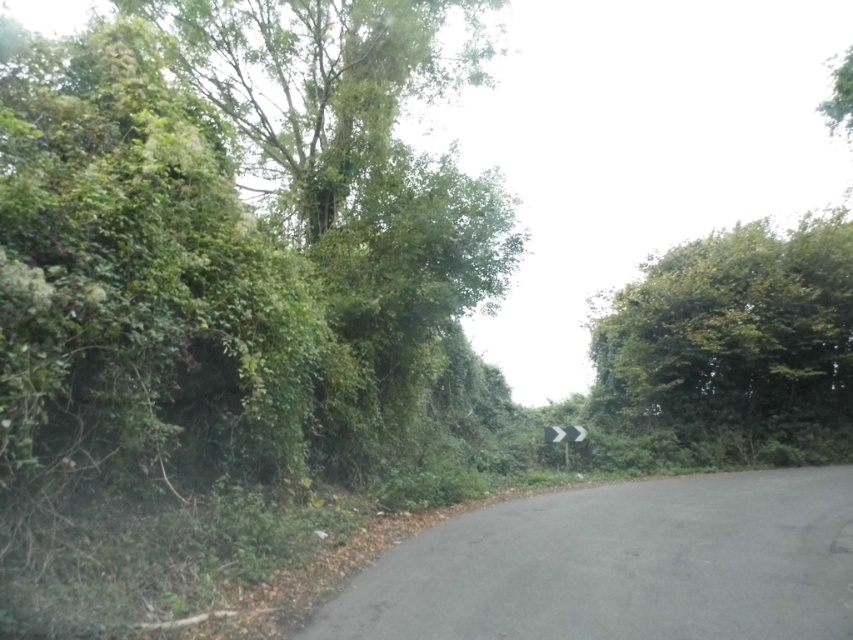
From the picture: You are standing at the center of the road and looking towards the direction of the curve. Which side of the road has the green leafy tree at right?

The green leafy tree at right is located on the right side of the road.

Looking at this image, you are a hiker trying to navigate through this rural road. You notice two trees, the green leafy tree at upper left and the green leafy tree at right. Which tree would you need to walk around if you want to stay on the road?

The green leafy tree at upper left has a larger width than the green leafy tree at right, so you would need to walk around the green leafy tree at upper left to stay on the road.

You are a hiker standing at the center of the road and want to take a photo of both the green leafy tree at upper left and the green leafy tree at right. Which tree should you focus on first to ensure both are in the frame?

You should focus on the green leafy tree at upper left first because it is closer to you, so adjusting the camera to include it will naturally include the green leafy tree at right which is further away.